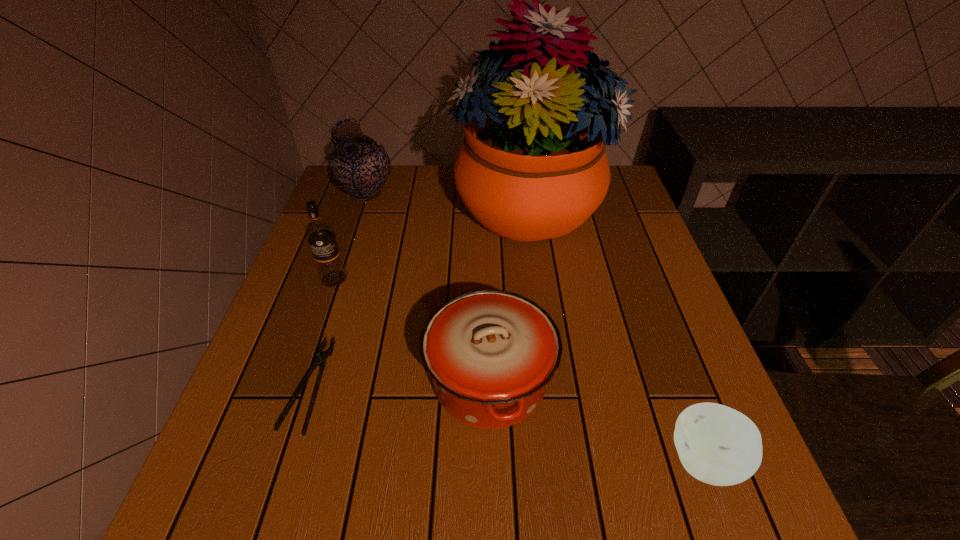
This screenshot has width=960, height=540. I want to click on object located in the far left corner section of the desktop, so click(359, 166).

This screenshot has width=960, height=540. I want to click on object that is positioned at the far right corner, so click(x=533, y=166).

Identify the location of object that is at the near right corner. click(x=718, y=445).

Identify the location of vacant area at the near edge. (500, 488).

The width and height of the screenshot is (960, 540). In the image, there is a desktop. Find the location of `vacant space at the left edge`. vacant space at the left edge is located at coordinates (313, 330).

Where is `blank area at the right edge`? blank area at the right edge is located at coordinates (595, 261).

The image size is (960, 540). In the image, there is a desktop. In order to click on vacant space at the far right corner in this screenshot , I will do `click(608, 194)`.

Locate an element on the screen. empty space that is in between the shortest object and the tallest object is located at coordinates (418, 296).

The height and width of the screenshot is (540, 960). Identify the location of free point between the third shortest object and the apple. (597, 421).

This screenshot has width=960, height=540. Find the location of `free point between the fourth tallest object and the vodka`. free point between the fourth tallest object and the vodka is located at coordinates (412, 329).